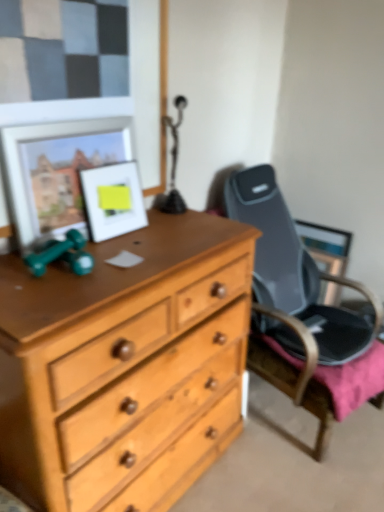
Question: Is matte silver picture frame at upper left, which is the 1th picture frame in left-to-right order, looking in the opposite direction of matte white picture frame at upper left, marked as the 1th picture frame in a right-to-left arrangement?

Choices:
 (A) yes
 (B) no

Answer: (A)

Question: Does matte silver picture frame at upper left, the second picture frame when ordered from right to left, have a greater width compared to matte white picture frame at upper left, which is the second picture frame in left-to-right order?

Choices:
 (A) yes
 (B) no

Answer: (B)

Question: From a real-world perspective, is matte silver picture frame at upper left, which is the 1th picture frame in left-to-right order, on matte white picture frame at upper left, marked as the 1th picture frame in a right-to-left arrangement?

Choices:
 (A) yes
 (B) no

Answer: (A)

Question: Is matte silver picture frame at upper left, the second picture frame when ordered from right to left, thinner than matte white picture frame at upper left, which is the second picture frame in left-to-right order?

Choices:
 (A) no
 (B) yes

Answer: (B)

Question: From a real-world perspective, is matte silver picture frame at upper left, the second picture frame when ordered from right to left, located beneath matte white picture frame at upper left, which is the second picture frame in left-to-right order?

Choices:
 (A) no
 (B) yes

Answer: (A)

Question: Is matte silver picture frame at upper left, the second picture frame when ordered from right to left, surrounding matte white picture frame at upper left, marked as the 1th picture frame in a right-to-left arrangement?

Choices:
 (A) no
 (B) yes

Answer: (B)

Question: Are matte white picture frame at upper left, which is the second picture frame in left-to-right order, and matte silver picture frame at upper left, the second picture frame when ordered from right to left, making contact?

Choices:
 (A) yes
 (B) no

Answer: (B)

Question: Could you tell me if matte white picture frame at upper left, marked as the 1th picture frame in a right-to-left arrangement, is turned towards matte silver picture frame at upper left, the second picture frame when ordered from right to left?

Choices:
 (A) no
 (B) yes

Answer: (A)

Question: Is matte white picture frame at upper left, which is the second picture frame in left-to-right order, not near matte silver picture frame at upper left, the second picture frame when ordered from right to left?

Choices:
 (A) no
 (B) yes

Answer: (A)

Question: Is matte silver picture frame at upper left, which is the 1th picture frame in left-to-right order, at the back of matte white picture frame at upper left, marked as the 1th picture frame in a right-to-left arrangement?

Choices:
 (A) no
 (B) yes

Answer: (B)

Question: Considering the relative positions of matte white picture frame at upper left, marked as the 1th picture frame in a right-to-left arrangement, and matte silver picture frame at upper left, the second picture frame when ordered from right to left, in the image provided, is matte white picture frame at upper left, marked as the 1th picture frame in a right-to-left arrangement, to the left of matte silver picture frame at upper left, the second picture frame when ordered from right to left, from the viewer's perspective?

Choices:
 (A) no
 (B) yes

Answer: (A)

Question: Can you confirm if matte white picture frame at upper left, marked as the 1th picture frame in a right-to-left arrangement, is smaller than matte silver picture frame at upper left, which is the 1th picture frame in left-to-right order?

Choices:
 (A) yes
 (B) no

Answer: (A)

Question: Does point (41, 129) appear closer or farther from the camera than point (94, 202)?

Choices:
 (A) closer
 (B) farther

Answer: (A)